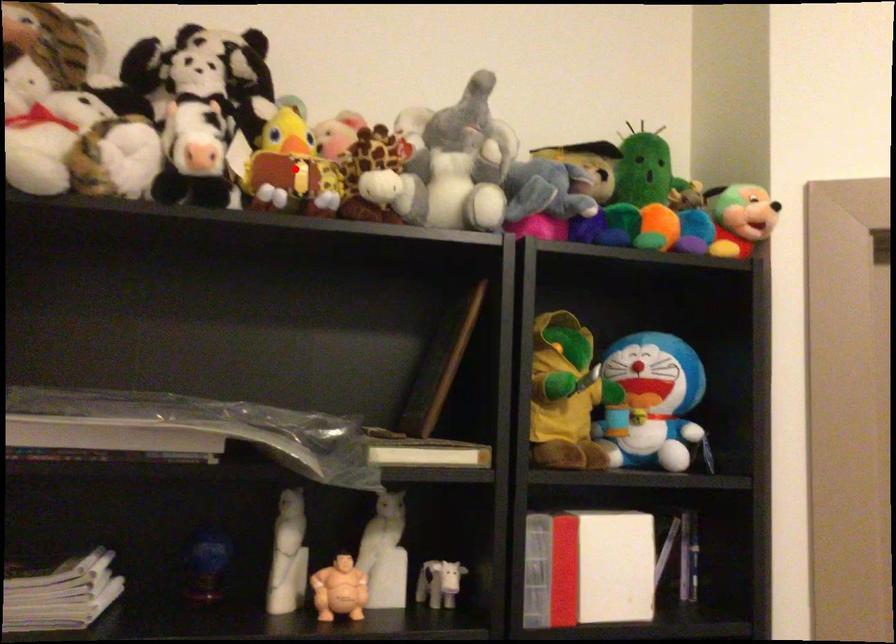
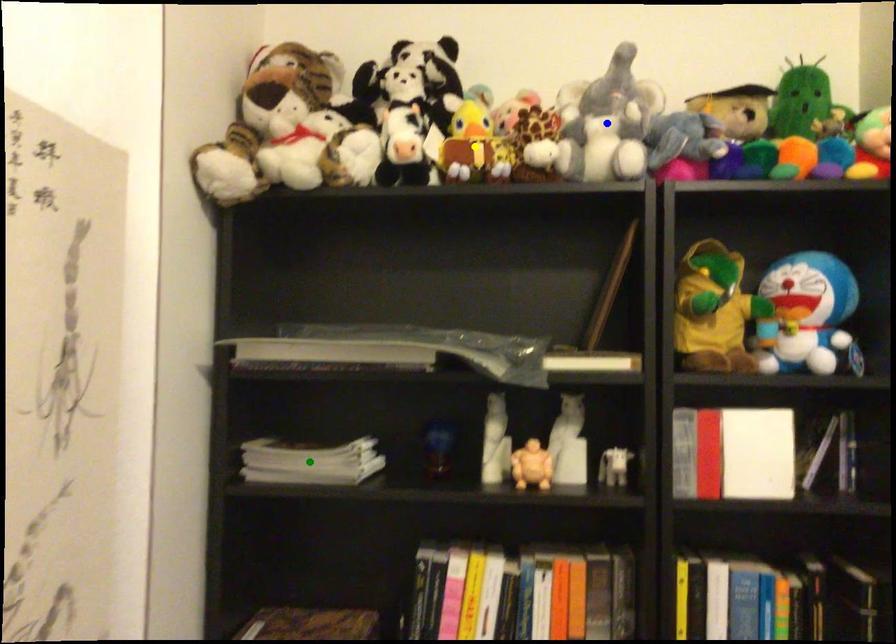
Question: I am providing you with two images of the same scene from different viewpoints. A red point is marked on the first image. You are given multiple points on the second image. Can you choose the point in image 2 that corresponds to the point in image 1?

Choices:
 (A) green point
 (B) blue point
 (C) yellow point

Answer: (C)